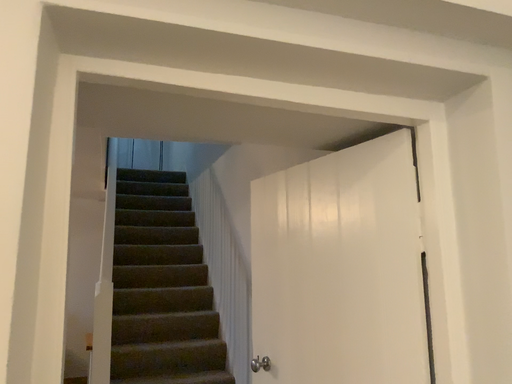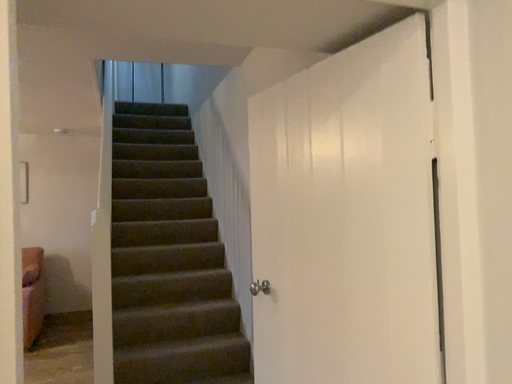
Question: How did the camera likely rotate when shooting the video?

Choices:
 (A) rotated upward
 (B) rotated downward

Answer: (B)